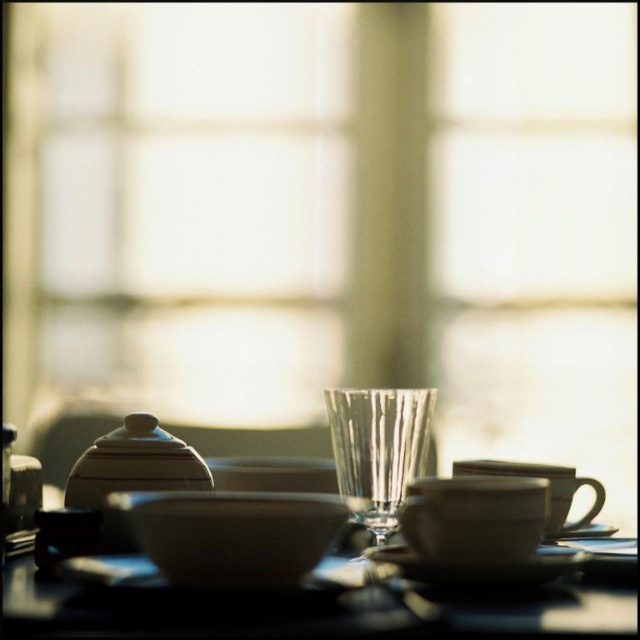
You are a waiter carrying a tray of dishes. You need to place a new plate between the white glossy bowl at center and the matte white teapot at left. Is there enough space between them to fit a plate that is 5 inches wide?

The distance between the white glossy bowl at center and the matte white teapot at left is 4.95 inches. Since the plate is 5 inches wide, it will not fit in the space between them.

You are arranging a dinner setting and need to place a centerpiece. The white glossy bowl at center and the matte white teapot at left are already on the table. Based on their positions, where should you place the centerpiece to ensure it is between them?

The white glossy bowl at center is to the right of the matte white teapot at left, so placing the centerpiece between them would require positioning it to the right of the matte white teapot at left and to the left of the white glossy bowl at center.